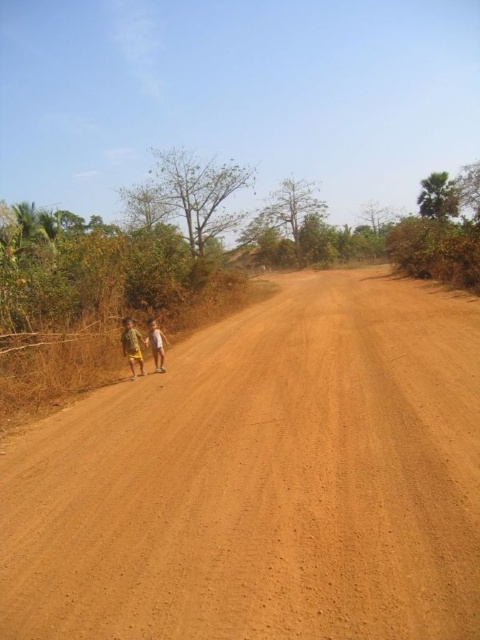
Who is taller, camouflage fabric shirt at left or light brown skin at left?

camouflage fabric shirt at left is taller.

Is camouflage fabric shirt at left to the left of light brown skin at left from the viewer's perspective?

Indeed, camouflage fabric shirt at left is positioned on the left side of light brown skin at left.

Where is `camouflage fabric shirt at left`? camouflage fabric shirt at left is located at coordinates (132, 346).

Is brown sandy dirt track at center taller than light brown skin at left?

Correct, brown sandy dirt track at center is much taller as light brown skin at left.

Between brown sandy dirt track at center and light brown skin at left, which one appears on the left side from the viewer's perspective?

light brown skin at left

Does point (276, 298) come in front of point (153, 320)?

No, (276, 298) is further to viewer.

This screenshot has width=480, height=640. Identify the location of brown sandy dirt track at center. (264, 481).

From the picture: Which is more to the left, brown sandy dirt track at center or yellow fabric shorts at left?

From the viewer's perspective, yellow fabric shorts at left appears more on the left side.

In the scene shown: Can you confirm if brown sandy dirt track at center is bigger than yellow fabric shorts at left?

Yes, brown sandy dirt track at center is bigger than yellow fabric shorts at left.

Find the location of a particular element. The height and width of the screenshot is (640, 480). brown sandy dirt track at center is located at coordinates (264, 481).

You are a GUI agent. You are given a task and a screenshot of the screen. Output one action in this format:
    pyautogui.click(x=<x>, y=<y>)
    Task: Click on the brown sandy dirt track at center
    The width and height of the screenshot is (480, 640).
    Given the screenshot: What is the action you would take?
    pyautogui.click(x=264, y=481)